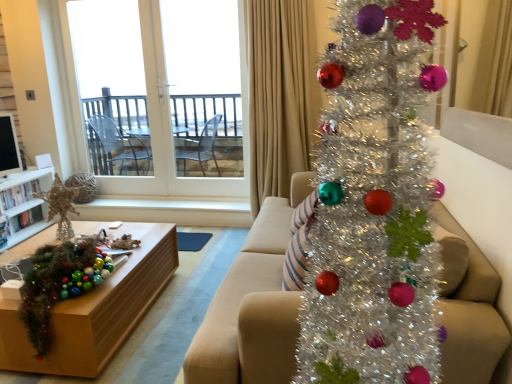
Question: From the image's perspective, is matte beige couch at center on shiny green tinsel garland at lower left?

Choices:
 (A) yes
 (B) no

Answer: (A)

Question: Is matte beige couch at center thinner than shiny green tinsel garland at lower left?

Choices:
 (A) no
 (B) yes

Answer: (A)

Question: Is the depth of matte beige couch at center less than that of shiny green tinsel garland at lower left?

Choices:
 (A) no
 (B) yes

Answer: (B)

Question: Can you confirm if matte beige couch at center is positioned to the left of shiny green tinsel garland at lower left?

Choices:
 (A) yes
 (B) no

Answer: (B)

Question: Is matte beige couch at center facing towards shiny green tinsel garland at lower left?

Choices:
 (A) no
 (B) yes

Answer: (B)

Question: In terms of width, does shiny green tinsel garland at lower left look wider or thinner when compared to white glass door at upper left?

Choices:
 (A) wide
 (B) thin

Answer: (A)

Question: Considering the positions of shiny green tinsel garland at lower left and white glass door at upper left in the image, is shiny green tinsel garland at lower left bigger or smaller than white glass door at upper left?

Choices:
 (A) big
 (B) small

Answer: (B)

Question: Does point (33, 269) appear closer or farther from the camera than point (162, 170)?

Choices:
 (A) farther
 (B) closer

Answer: (B)

Question: Is shiny green tinsel garland at lower left inside or outside of white glass door at upper left?

Choices:
 (A) outside
 (B) inside

Answer: (A)

Question: Which is correct: white glass door at upper left is inside matte beige couch at center, or outside of it?

Choices:
 (A) inside
 (B) outside

Answer: (B)

Question: Is point (114, 119) positioned closer to the camera than point (256, 251)?

Choices:
 (A) farther
 (B) closer

Answer: (A)

Question: In the image, is white glass door at upper left positioned in front of or behind matte beige couch at center?

Choices:
 (A) behind
 (B) front

Answer: (A)

Question: Is white glass door at upper left taller or shorter than matte beige couch at center?

Choices:
 (A) short
 (B) tall

Answer: (B)

Question: From the image's perspective, is beige fabric curtain at upper right above or below shiny green tinsel garland at lower left?

Choices:
 (A) below
 (B) above

Answer: (B)

Question: Choose the correct answer: Is beige fabric curtain at upper right inside shiny green tinsel garland at lower left or outside it?

Choices:
 (A) outside
 (B) inside

Answer: (A)